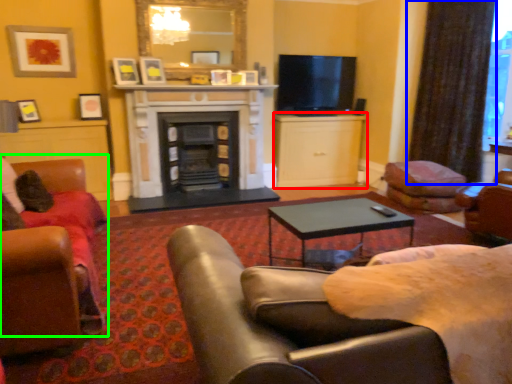
Question: Estimate the real-world distances between objects in this image. Which object is farther from cabinetry (highlighted by a red box), curtain (highlighted by a blue box) or chair (highlighted by a green box)?

Choices:
 (A) curtain
 (B) chair

Answer: (B)